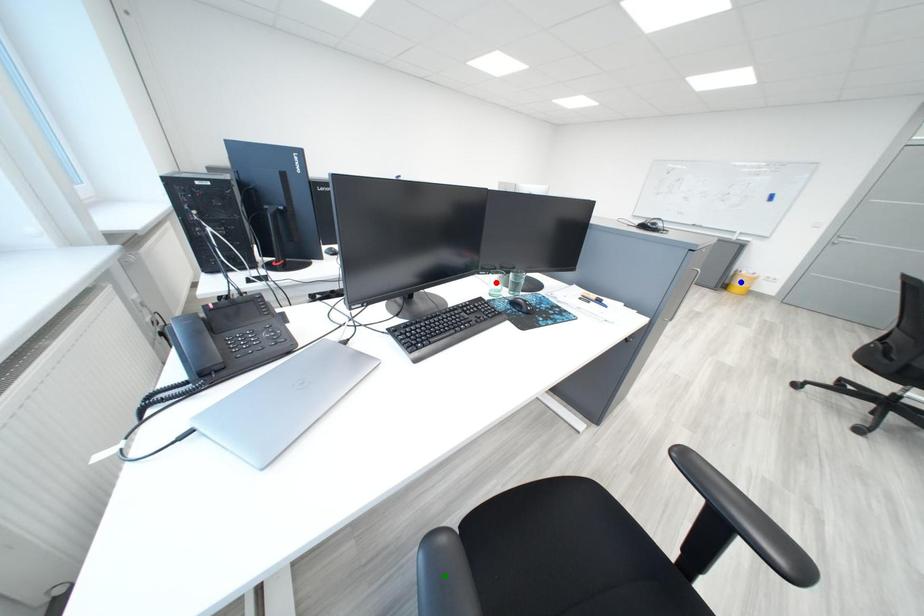
Order these from nearest to farthest:
- blue point
- green point
- red point

blue point < red point < green point